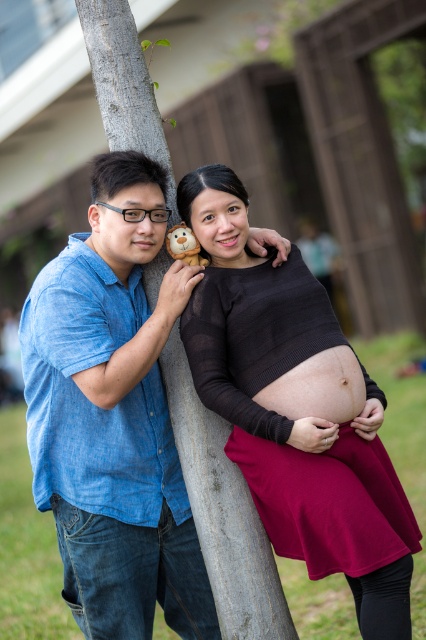
You are a photographer setting up for a maternity photo shoot. You need to ensure that the blue denim shirt at left and the matte black sweater at center are visible in the frame. Based on their heights, which clothing item will appear taller in the photo?

The blue denim shirt at left will appear taller in the photo because it has a greater height compared to the matte black sweater at center.

You are a photographer holding a camera. You want to take a photo of the gray rough tree trunk at center from a distance that allows you to capture the entire trunk in the frame. If your camera has a maximum focal length of 50mm and you are using a full frame sensor, what is the minimum distance you should stand from the tree trunk to ensure the entire trunk fits in the frame?

The gray rough tree trunk at center and camera are 3.27 meters apart. To capture the entire trunk in the frame with a 50mm lens on a full frame sensor, the minimum distance should be at least 3.27 meters, as the current distance already allows the trunk to be fully framed.

You are a photographer setting up for a maternity photoshoot. You need to ensure that both the blue denim shirt at left and the matte black sweater at center are visible in the final shot. Based on their positions, which clothing item should you focus on to ensure both are in focus?

The matte black sweater at center is behind the blue denim shirt at left. To ensure both are in focus, focus on the matte black sweater at center since it is farther away, as depth of field will include the closer blue denim shirt at left in the frame.